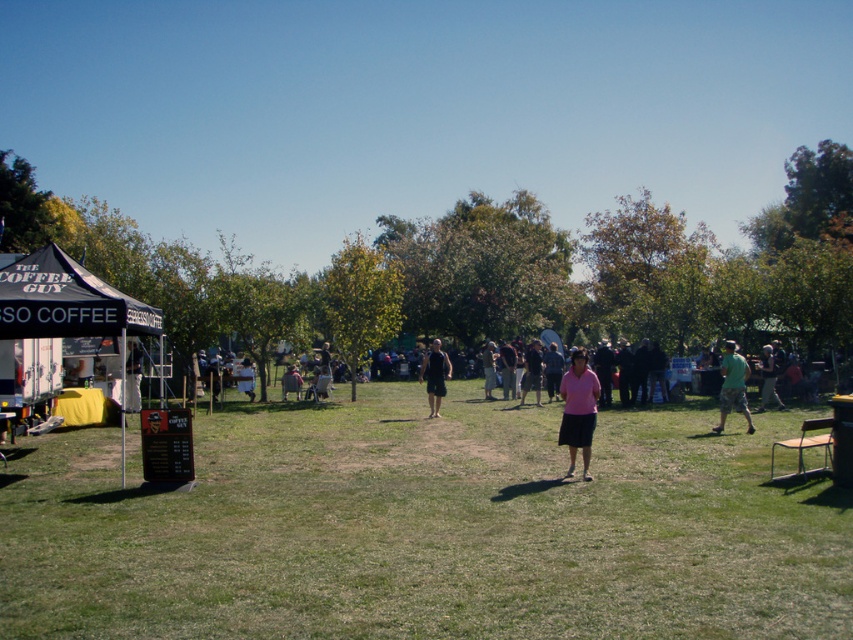
Between black fabric shirt at center and pink fabric shirt at center, which one appears on the left side from the viewer's perspective?

From the viewer's perspective, pink fabric shirt at center appears more on the left side.

The height and width of the screenshot is (640, 853). What do you see at coordinates (434, 376) in the screenshot?
I see `black fabric shirt at center` at bounding box center [434, 376].

This screenshot has height=640, width=853. Find the location of `black fabric shirt at center`. black fabric shirt at center is located at coordinates (434, 376).

In the scene shown: Measure the distance between pink fabric skirt at center and green cotton shirt at right.

18.51 feet

Between pink fabric skirt at center and green cotton shirt at right, which one appears on the right side from the viewer's perspective?

From the viewer's perspective, green cotton shirt at right appears more on the right side.

The width and height of the screenshot is (853, 640). Identify the location of pink fabric skirt at center. (578, 410).

Who is shorter, pink fabric shirt at center or dark gray shirt at center?

pink fabric shirt at center is shorter.

Does pink fabric shirt at center have a smaller size compared to dark gray shirt at center?

No, pink fabric shirt at center is not smaller than dark gray shirt at center.

Does point (312, 369) come farther from viewer compared to point (492, 362)?

Yes, point (312, 369) is farther from viewer.

You are a GUI agent. You are given a task and a screenshot of the screen. Output one action in this format:
    pyautogui.click(x=<x>, y=<y>)
    Task: Click on the pink fabric shirt at center
    This screenshot has height=640, width=853.
    Given the screenshot: What is the action you would take?
    pyautogui.click(x=322, y=376)